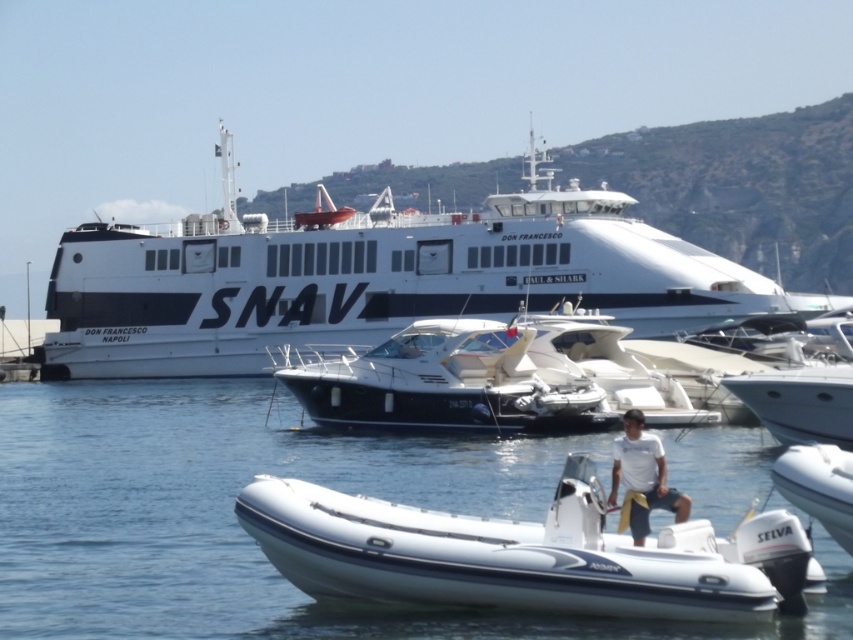
Question: Does white matte ferry boat at upper center have a lesser width compared to white rubber dinghy at lower right?

Choices:
 (A) yes
 (B) no

Answer: (B)

Question: Does white rubber boat at center appear on the left side of white rubber dinghy at center?

Choices:
 (A) yes
 (B) no

Answer: (A)

Question: Which point is closer to the camera taking this photo?

Choices:
 (A) (67, 552)
 (B) (395, 589)
 (C) (827, 468)

Answer: (B)

Question: Can you confirm if white rubber boat at center is positioned to the right of white rubber dinghy at lower right?

Choices:
 (A) no
 (B) yes

Answer: (A)

Question: Estimate the real-world distances between objects in this image. Which object is farther from the white matte ferry boat at upper center?

Choices:
 (A) white rubber dinghy at lower right
 (B) white rubber dinghy at center

Answer: (A)

Question: Which point is farther to the camera?

Choices:
 (A) white rubber dinghy at lower right
 (B) white rubber dinghy at center

Answer: (A)